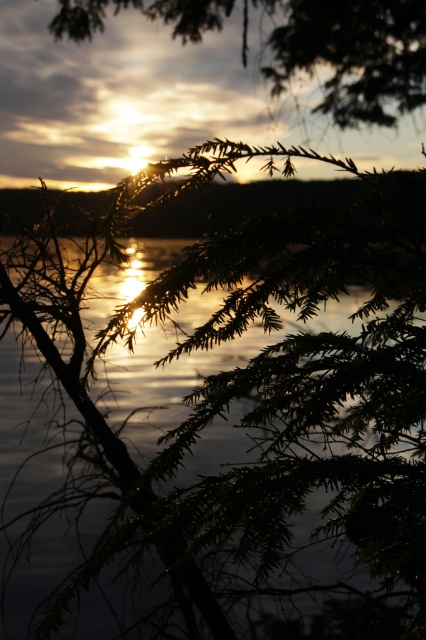
This screenshot has height=640, width=426. What do you see at coordinates (236, 426) in the screenshot?
I see `glistening reflective water at center` at bounding box center [236, 426].

Who is more forward, (388,337) or (419,29)?

Point (388,337) is more forward.

Is point (406, 256) more distant than point (281, 51)?

No, (406, 256) is closer to viewer.

I want to click on glistening reflective water at center, so click(x=236, y=426).